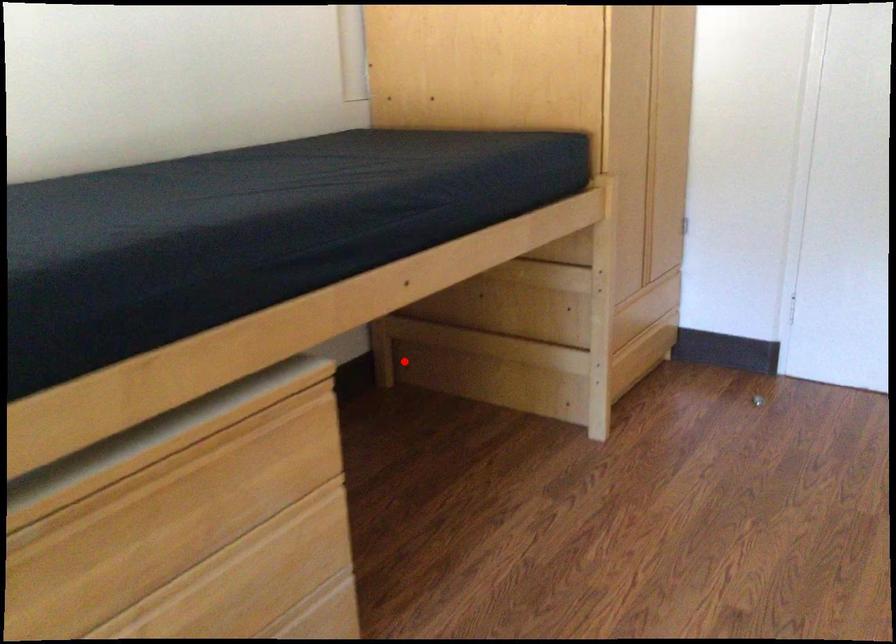
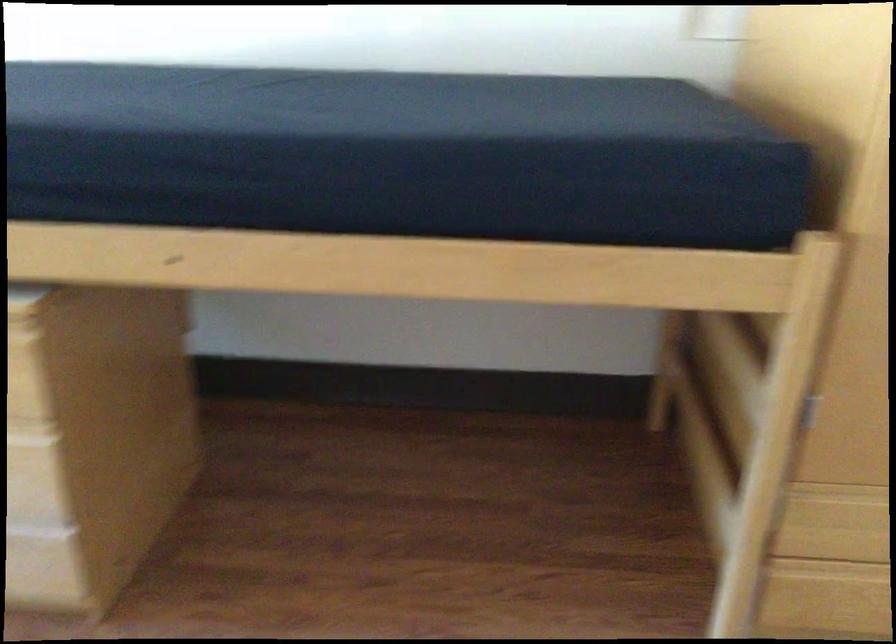
Find the pixel in the second image that matches the highlighted location in the first image.

(673, 408)